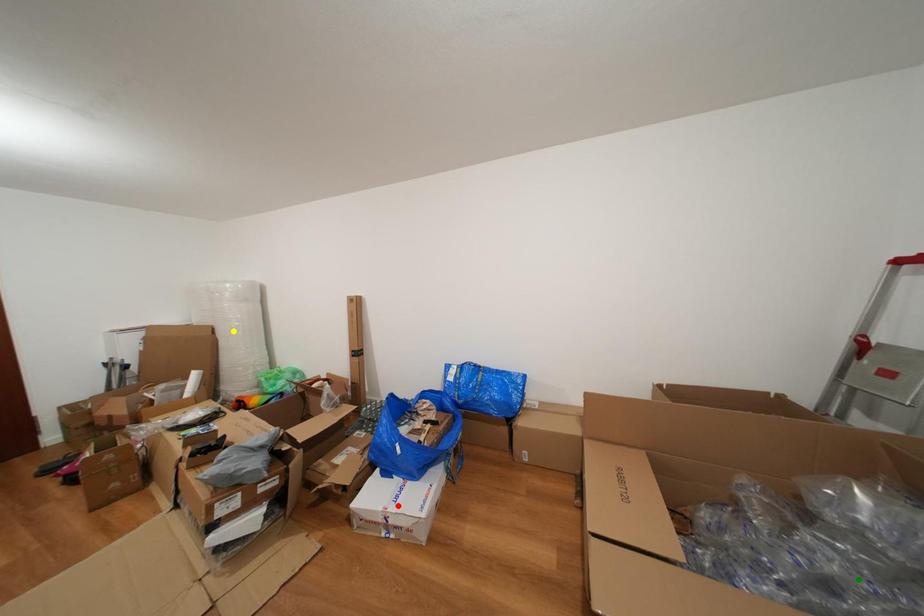
Order these from nearest to farthest:
green point, yellow point, red point

1. yellow point
2. red point
3. green point